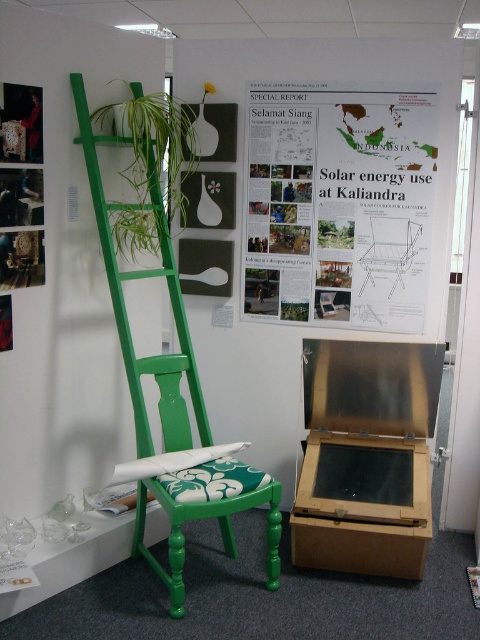
Question: Which object appears farthest from the camera in this image?

Choices:
 (A) white paper at upper center
 (B) green painted wood ladder at center
 (C) green leafy plant at upper left
 (D) green painted wood chair at center

Answer: (A)

Question: Which point appears farthest from the camera in this image?

Choices:
 (A) (133, 240)
 (B) (310, 257)
 (C) (356, 442)

Answer: (B)

Question: Is green painted wood ladder at center wider than green painted wood chair at center?

Choices:
 (A) no
 (B) yes

Answer: (B)

Question: Which is farther from the green painted wood ladder at center?

Choices:
 (A) white paper at upper center
 (B) metallic cardboard box at lower center
 (C) green painted wood chair at center
 (D) green leafy plant at upper left

Answer: (A)

Question: In this image, where is metallic cardboard box at lower center located relative to green painted wood chair at center?

Choices:
 (A) above
 (B) below

Answer: (A)

Question: Is metallic cardboard box at lower center below green leafy plant at upper left?

Choices:
 (A) no
 (B) yes

Answer: (B)